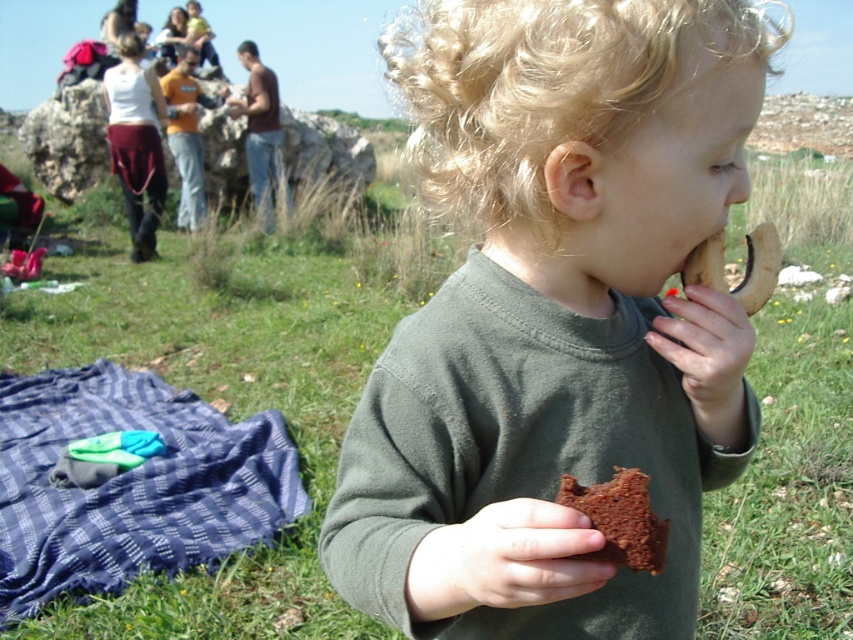
Can you confirm if dark green shirt at center is positioned to the right of blue plaid blanket at lower left?

Indeed, dark green shirt at center is positioned on the right side of blue plaid blanket at lower left.

Between dark green shirt at center and blue plaid blanket at lower left, which one is positioned lower?

Positioned lower is blue plaid blanket at lower left.

Who is more forward, [730,17] or [227,550]?

Point [730,17] is more forward.

At what (x,y) coordinates should I click in order to perform the action: click on dark green shirt at center. Please return your answer as a coordinate pair (x, y). The image size is (853, 640). Looking at the image, I should click on (556, 317).

Can you confirm if dark green shirt at center is smaller than brown crumbly cookie at right?

No, dark green shirt at center is not smaller than brown crumbly cookie at right.

Can you confirm if dark green shirt at center is positioned below brown crumbly cookie at right?

Yes, dark green shirt at center is below brown crumbly cookie at right.

This screenshot has width=853, height=640. Describe the element at coordinates (556, 317) in the screenshot. I see `dark green shirt at center` at that location.

At what (x,y) coordinates should I click in order to perform the action: click on dark green shirt at center. Please return your answer as a coordinate pair (x, y). Looking at the image, I should click on (556, 317).

Between point (460, 352) and point (639, 554), which one is positioned behind?

The point (460, 352) is more distant.

Is dark green shirt at center further to camera compared to chocolate cake at center?

That is False.

Does point (471, 300) lie behind point (590, 492)?

That is True.

Image resolution: width=853 pixels, height=640 pixels. Identify the location of dark green shirt at center. (556, 317).